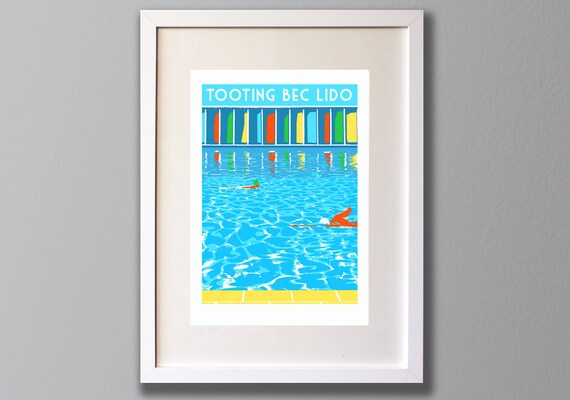
Locate an element on the screen. The width and height of the screenshot is (570, 400). shadow of picture frame is located at coordinates (427, 275), (301, 390), (137, 113).